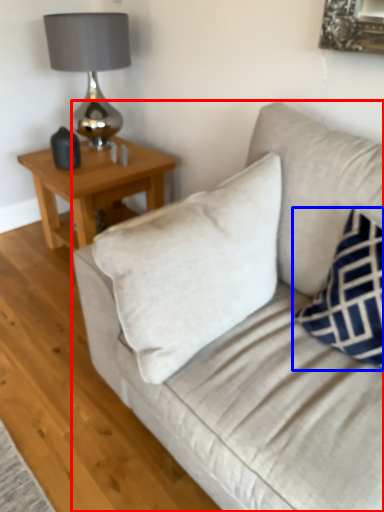
Question: Which of the following is the farthest to the observer, studio couch (highlighted by a red box) or pillow (highlighted by a blue box)?

Choices:
 (A) studio couch
 (B) pillow

Answer: (B)